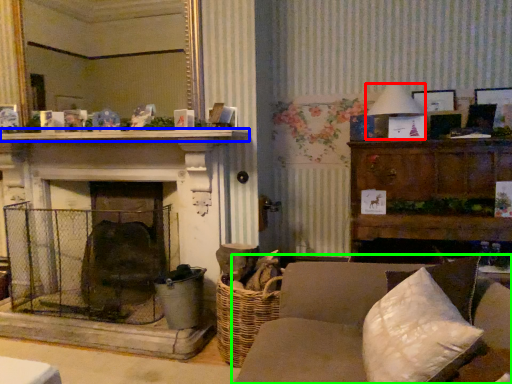
Question: Considering the real-world distances, which object is farthest from lamp (highlighted by a red box)? mantle (highlighted by a blue box) or studio couch (highlighted by a green box)?

Choices:
 (A) mantle
 (B) studio couch

Answer: (B)